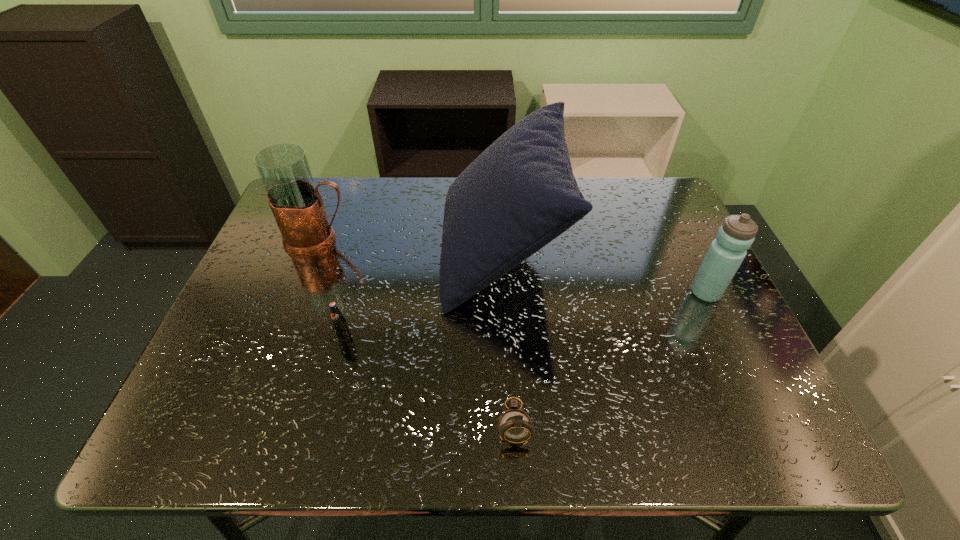
In order to click on cushion in this screenshot , I will do `click(518, 195)`.

Locate an element on the screen. This screenshot has width=960, height=540. the leftmost object is located at coordinates (296, 203).

Where is `water bottle`? This screenshot has width=960, height=540. water bottle is located at coordinates (735, 236).

Find the location of a particular element. Image resolution: width=960 pixels, height=540 pixels. pop is located at coordinates (338, 321).

This screenshot has width=960, height=540. In order to click on the fourth farthest object in this screenshot , I will do `click(338, 321)`.

What are the coordinates of `the shortest object` in the screenshot? It's located at coord(515,426).

Find the location of a particular element. This screenshot has height=540, width=960. the nearest object is located at coordinates (515, 426).

You are a GUI agent. You are given a task and a screenshot of the screen. Output one action in this format:
    pyautogui.click(x=<x>, y=<y>)
    Task: Click on the vacant area located on the facing side of the cushion
    The image size is (960, 540).
    Given the screenshot: What is the action you would take?
    click(330, 252)

In order to click on vacant space situated on the facing side of the cushion in this screenshot , I will do `click(379, 252)`.

What are the coordinates of `vacant space located 0.370m on the facing side of the cushion` in the screenshot? It's located at click(x=303, y=252).